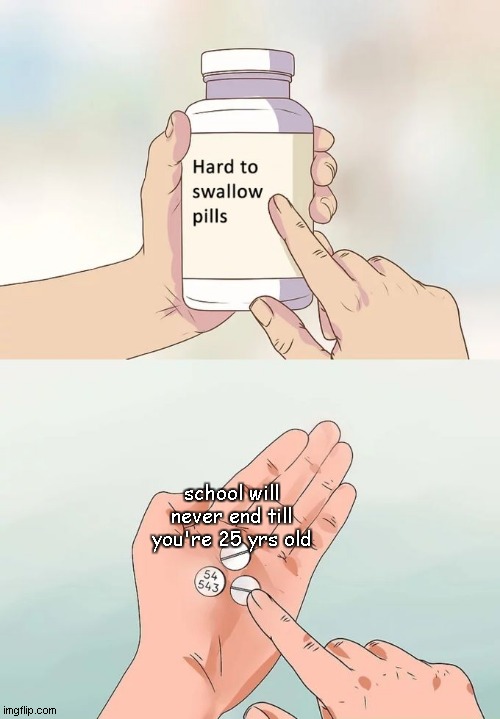
At what (x,y) coordinates should I click in order to perform the action: click on pill bottle. Please return your answer as a coordinate pair (x, y). This screenshot has height=719, width=500. Looking at the image, I should click on (220, 257).